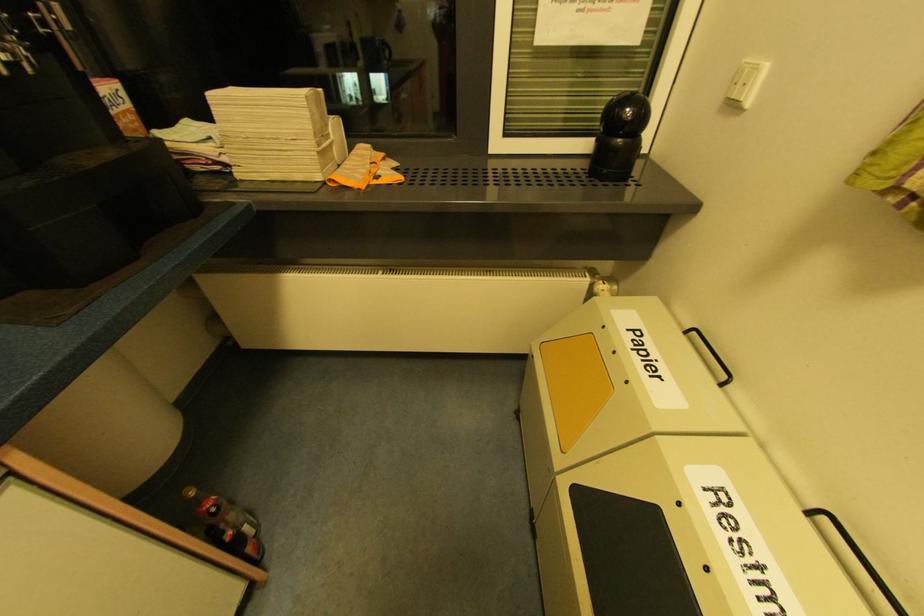
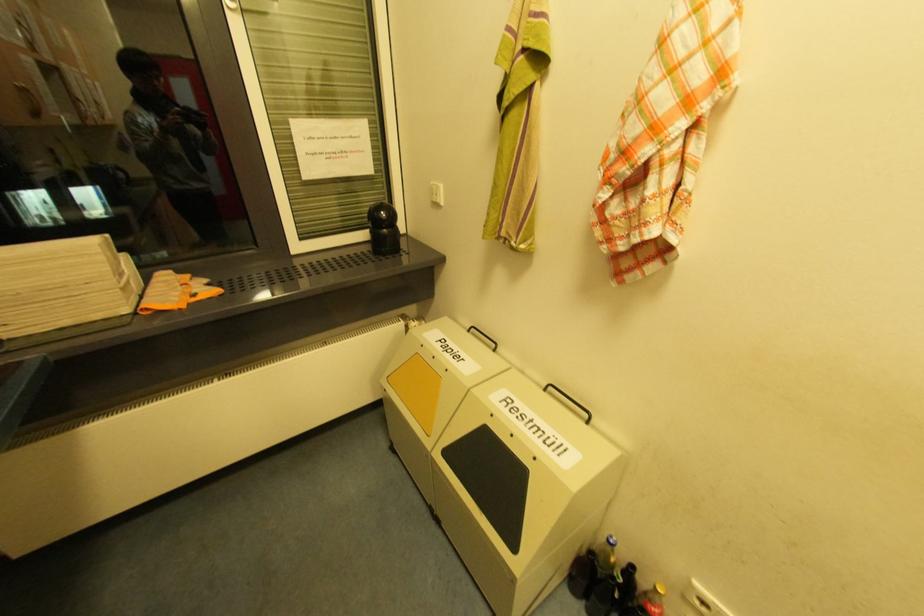
In the second image, find the point that corresponds to (736,107) in the first image.

(440, 205)